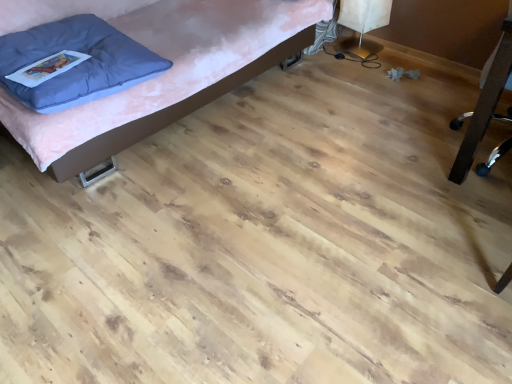
This screenshot has height=384, width=512. Find the location of `free location to the left of black plastic chair at right, which ranks as the first furniture in right-to-left order`. free location to the left of black plastic chair at right, which ranks as the first furniture in right-to-left order is located at coordinates (389, 154).